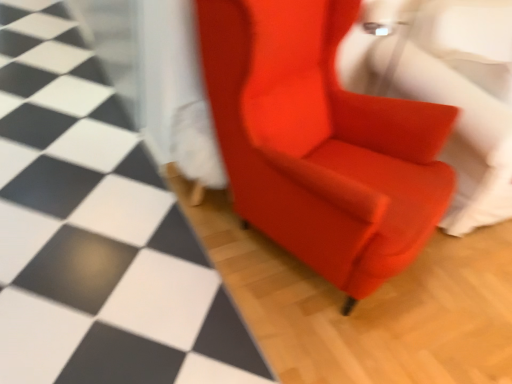
Question: Is satin red armchair at center not close to satin red armchair at center?

Choices:
 (A) yes
 (B) no

Answer: (B)

Question: From a real-world perspective, does satin red armchair at center sit lower than satin red armchair at center?

Choices:
 (A) yes
 (B) no

Answer: (A)

Question: From a real-world perspective, is satin red armchair at center on satin red armchair at center?

Choices:
 (A) no
 (B) yes

Answer: (A)

Question: From the image's perspective, does satin red armchair at center appear higher than satin red armchair at center?

Choices:
 (A) no
 (B) yes

Answer: (B)

Question: Does satin red armchair at center contain satin red armchair at center?

Choices:
 (A) yes
 (B) no

Answer: (B)

Question: Based on their sizes in the image, would you say satin red armchair at center is bigger or smaller than matte red armchair at center?

Choices:
 (A) small
 (B) big

Answer: (B)

Question: Based on their positions, is satin red armchair at center located to the left or right of matte red armchair at center?

Choices:
 (A) left
 (B) right

Answer: (B)

Question: Considering the positions of satin red armchair at center and matte red armchair at center in the image, is satin red armchair at center taller or shorter than matte red armchair at center?

Choices:
 (A) tall
 (B) short

Answer: (A)

Question: From a real-world perspective, is satin red armchair at center positioned above or below matte red armchair at center?

Choices:
 (A) below
 (B) above

Answer: (B)

Question: Considering their positions, is satin red armchair at center located in front of or behind satin red armchair at center?

Choices:
 (A) behind
 (B) front

Answer: (A)

Question: Which is correct: satin red armchair at center is inside satin red armchair at center, or outside of it?

Choices:
 (A) outside
 (B) inside

Answer: (A)

Question: Visually, is satin red armchair at center positioned to the left or to the right of satin red armchair at center?

Choices:
 (A) left
 (B) right

Answer: (B)

Question: Is satin red armchair at center wider or thinner than satin red armchair at center?

Choices:
 (A) thin
 (B) wide

Answer: (B)

Question: Is point (225, 304) positioned closer to the camera than point (382, 231)?

Choices:
 (A) closer
 (B) farther

Answer: (B)

Question: From the image's perspective, is matte red armchair at center positioned above or below satin red armchair at center?

Choices:
 (A) above
 (B) below

Answer: (A)